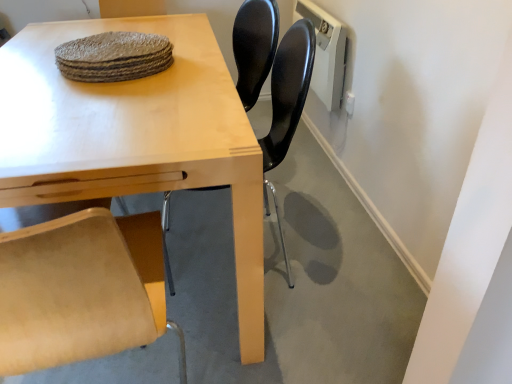
Question: Are light wood table at center and black plastic chair at center far apart?

Choices:
 (A) no
 (B) yes

Answer: (A)

Question: Considering the relative sizes of light wood table at center and black plastic chair at center in the image provided, is light wood table at center taller than black plastic chair at center?

Choices:
 (A) no
 (B) yes

Answer: (A)

Question: From a real-world perspective, does light wood table at center sit lower than black plastic chair at center?

Choices:
 (A) no
 (B) yes

Answer: (B)

Question: Does light wood table at center have a lesser width compared to black plastic chair at center?

Choices:
 (A) no
 (B) yes

Answer: (A)

Question: Is light wood table at center wider than black plastic chair at center?

Choices:
 (A) yes
 (B) no

Answer: (A)

Question: From their relative heights in the image, would you say rough woven placemat at upper center is taller or shorter than black plastic chair at center?

Choices:
 (A) tall
 (B) short

Answer: (B)

Question: Is rough woven placemat at upper center bigger or smaller than black plastic chair at center?

Choices:
 (A) small
 (B) big

Answer: (A)

Question: In the image, is rough woven placemat at upper center positioned in front of or behind black plastic chair at center?

Choices:
 (A) front
 (B) behind

Answer: (B)

Question: Considering the relative positions of rough woven placemat at upper center and black plastic chair at center in the image provided, is rough woven placemat at upper center to the left or to the right of black plastic chair at center?

Choices:
 (A) right
 (B) left

Answer: (B)

Question: Is point (152, 354) closer or farther from the camera than point (69, 140)?

Choices:
 (A) farther
 (B) closer

Answer: (A)

Question: Looking at the image, does light wood table at center seem bigger or smaller compared to light wood table at center?

Choices:
 (A) big
 (B) small

Answer: (B)

Question: Choose the correct answer: Is light wood table at center inside light wood table at center or outside it?

Choices:
 (A) outside
 (B) inside

Answer: (A)

Question: From a real-world perspective, relative to light wood table at center, is light wood table at center vertically above or below?

Choices:
 (A) below
 (B) above

Answer: (A)

Question: Looking at their shapes, would you say light wood table at center is wider or thinner than light wood table at center?

Choices:
 (A) wide
 (B) thin

Answer: (B)

Question: Is light wood table at center in front of or behind light wood table at center in the image?

Choices:
 (A) behind
 (B) front

Answer: (B)